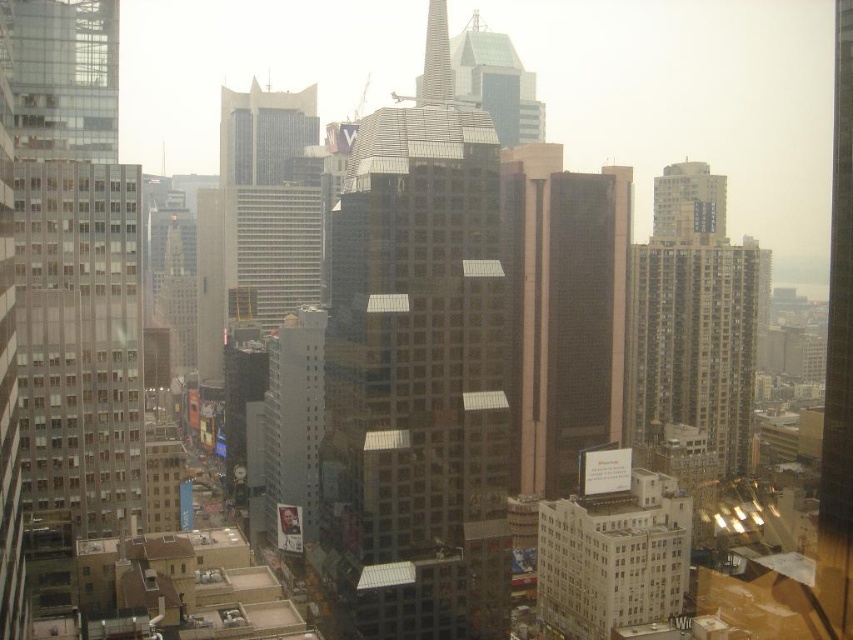
Question: Which of the following is the closest to the observer?

Choices:
 (A) glossy glass skyscraper at center
 (B) white smooth building at center
 (C) white concrete billboard at lower right
 (D) transparent glass skyscraper at left

Answer: (D)

Question: Does transparent glass skyscraper at left appear on the right side of white smooth building at center?

Choices:
 (A) no
 (B) yes

Answer: (A)

Question: Can you confirm if transparent glass skyscraper at left is smaller than white concrete billboard at lower right?

Choices:
 (A) no
 (B) yes

Answer: (A)

Question: Estimate the real-world distances between objects in this image. Which object is farther from the white smooth building at center?

Choices:
 (A) white concrete billboard at lower right
 (B) transparent glass skyscraper at left

Answer: (B)

Question: Does transparent glass skyscraper at left have a greater width compared to white smooth building at center?

Choices:
 (A) yes
 (B) no

Answer: (A)

Question: Which object is the farthest from the glossy glass skyscraper at center?

Choices:
 (A) white smooth building at center
 (B) transparent glass skyscraper at left
 (C) white concrete billboard at lower right

Answer: (B)